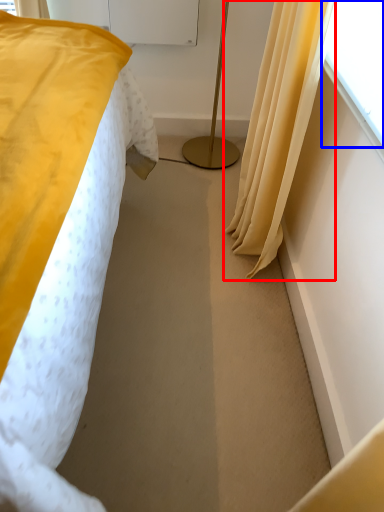
Question: Among these objects, which one is farthest to the camera, curtain (highlighted by a red box) or window screen (highlighted by a blue box)?

Choices:
 (A) curtain
 (B) window screen

Answer: (A)